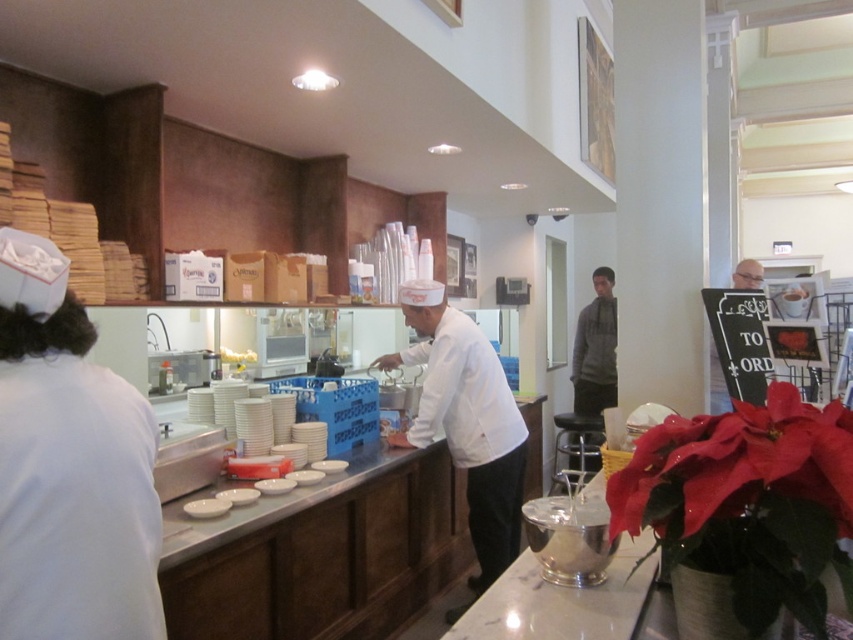
Consider the image. You are a new chef entering the kitchen and need to place a new utensil on the counter. Where is the white fabric chef hat at left located in relation to the counter?

The white fabric chef hat at left is located at point (68, 467) on the counter.

Based on the photo, you are a chef trying to place your white fabric chef hat at left on the counter. There is a black leather stool at center already occupying some space. Based on their widths, will the hat fit next to the stool on the counter?

The white fabric chef hat at left has a lesser width compared to the black leather stool at center, so it should fit next to the stool on the counter since it is narrower.

Based on the photo, you are a customer looking at the kitchen staff through the service window. You notice two staff members wearing the white fabric chef hat at left and the smooth bald head at upper right. Which staff member is positioned more to the left side?

The white fabric chef hat at left is positioned more to the left side than the smooth bald head at upper right.